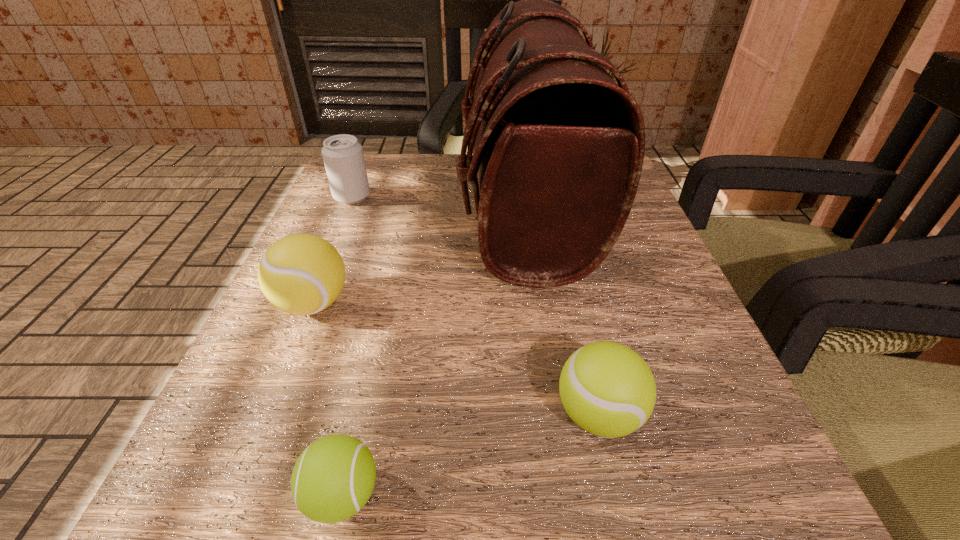
Where is `satchel`? Image resolution: width=960 pixels, height=540 pixels. satchel is located at coordinates (558, 146).

Identify the location of can. (343, 157).

Where is `the farthest tennis ball`? The image size is (960, 540). the farthest tennis ball is located at coordinates (301, 274).

At what (x,y) coordinates should I click in order to perform the action: click on the fourth farthest object. Please return your answer as a coordinate pair (x, y). Looking at the image, I should click on (607, 389).

You are a GUI agent. You are given a task and a screenshot of the screen. Output one action in this format:
    pyautogui.click(x=<x>, y=<y>)
    Task: Click on the second farthest tennis ball
    
    Given the screenshot: What is the action you would take?
    pyautogui.click(x=607, y=389)

You are a GUI agent. You are given a task and a screenshot of the screen. Output one action in this format:
    pyautogui.click(x=<x>, y=<y>)
    Task: Click on the shortest tennis ball
    The width and height of the screenshot is (960, 540).
    Given the screenshot: What is the action you would take?
    pyautogui.click(x=333, y=478)

Where is `the nearest tennis ball`? This screenshot has width=960, height=540. the nearest tennis ball is located at coordinates (333, 478).

The image size is (960, 540). Identify the location of vacant space situated 0.250m on the front-facing side of the tallest object. (337, 209).

You are a GUI agent. You are given a task and a screenshot of the screen. Output one action in this format:
    pyautogui.click(x=<x>, y=<y>)
    Task: Click on the free point located 0.200m on the front-facing side of the tallest object
    
    Given the screenshot: What is the action you would take?
    pyautogui.click(x=362, y=209)

The height and width of the screenshot is (540, 960). What are the coordinates of `vacant space situated 0.210m on the front-facing side of the tallest object` in the screenshot? It's located at (356, 209).